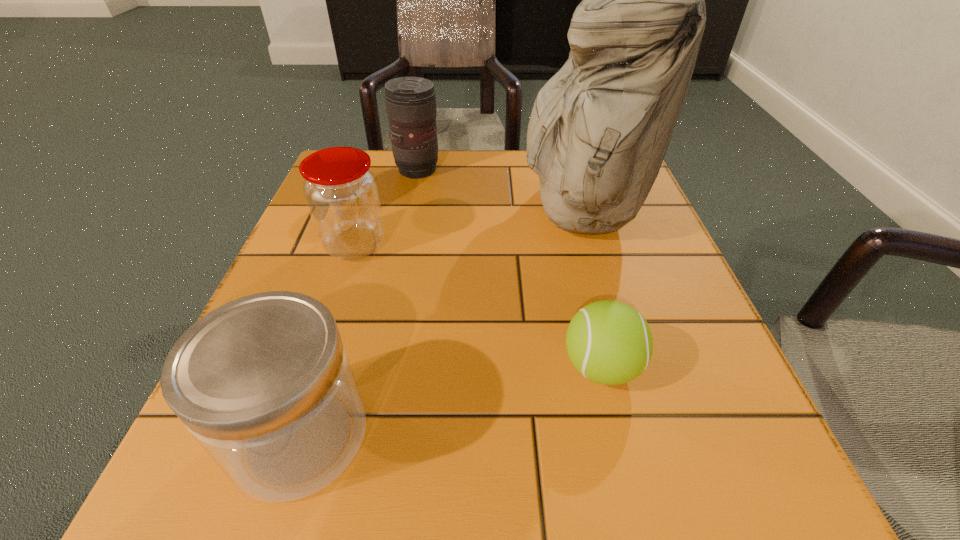
Image resolution: width=960 pixels, height=540 pixels. What are the coordinates of `unoccupied position between the farther jar and the shortest object` in the screenshot? It's located at pyautogui.click(x=478, y=306).

Where is `empty space between the telephoto lens and the backpack`? empty space between the telephoto lens and the backpack is located at coordinates (499, 190).

This screenshot has width=960, height=540. What are the coordinates of `free point between the shortest object and the tallest object` in the screenshot? It's located at (590, 288).

Where is `free spot between the shortest object and the farther jar`? free spot between the shortest object and the farther jar is located at coordinates [478, 306].

This screenshot has height=540, width=960. In order to click on vacant area that lies between the tallest object and the nearer jar in this screenshot , I will do `click(441, 322)`.

You are a GUI agent. You are given a task and a screenshot of the screen. Output one action in this format:
    pyautogui.click(x=<x>, y=<y>)
    Task: Click on the vacant space that's between the tallest object and the nearer jar
    Image resolution: width=960 pixels, height=540 pixels.
    Given the screenshot: What is the action you would take?
    pyautogui.click(x=441, y=322)

Where is `object that is the third nearest to the nearer jar`? This screenshot has width=960, height=540. object that is the third nearest to the nearer jar is located at coordinates (600, 127).

Identify which object is the second nearest to the nearer jar. Please provide its 2D coordinates. Your answer should be formatted as a tuple, i.e. [(x, y)], where the tuple contains the x and y coordinates of a point satisfying the conditions above.

[(609, 342)]

Where is `free space that satisfies the following two spatial constraints: 1. on the side of the telephoto lens where the control switches are located; 2. on the left side of the tennis ball`? The width and height of the screenshot is (960, 540). free space that satisfies the following two spatial constraints: 1. on the side of the telephoto lens where the control switches are located; 2. on the left side of the tennis ball is located at coordinates (377, 367).

Locate an element on the screen. Image resolution: width=960 pixels, height=540 pixels. blank space that satisfies the following two spatial constraints: 1. on the side of the telephoto lens where the control switches are located; 2. on the right side of the shortest object is located at coordinates (377, 367).